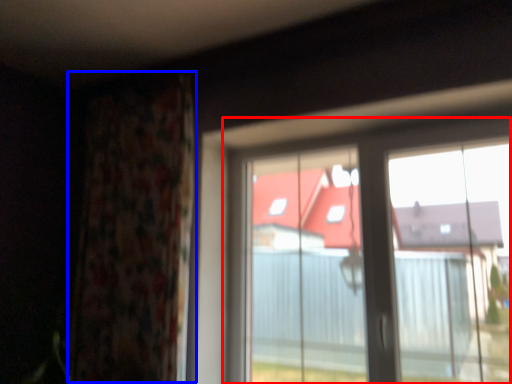
Question: Which object is further to the camera taking this photo, window (highlighted by a red box) or curtain (highlighted by a blue box)?

Choices:
 (A) window
 (B) curtain

Answer: (B)